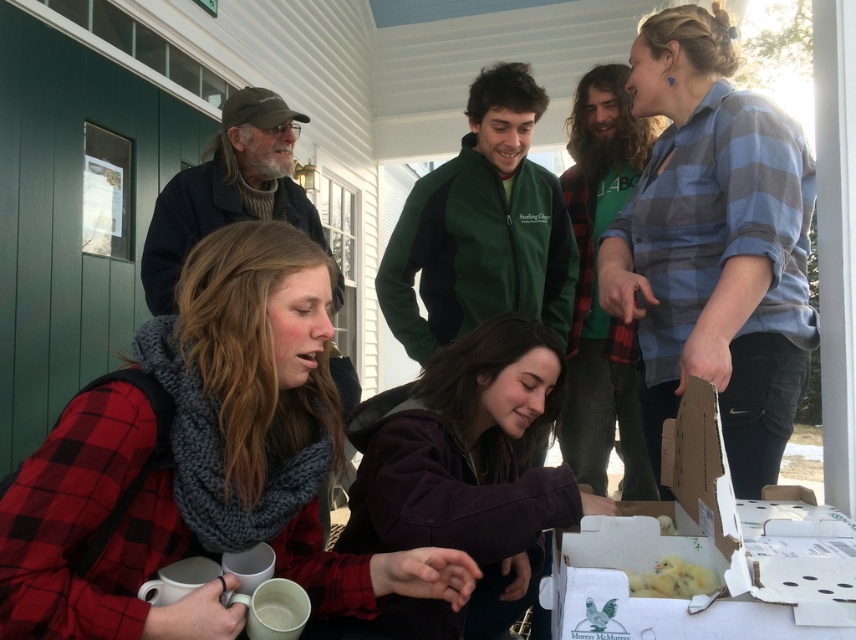
You are organizing a photo shoot and need to arrange the red plaid shirt at lower left and the purple soft fabric at center in a way that they don not overlap. Given their sizes, which one should be placed further back to avoid overlapping?

The red plaid shirt at lower left might be wider than purple soft fabric at center, so placing the red plaid shirt at lower left further back would help avoid overlapping due to its potentially larger width.